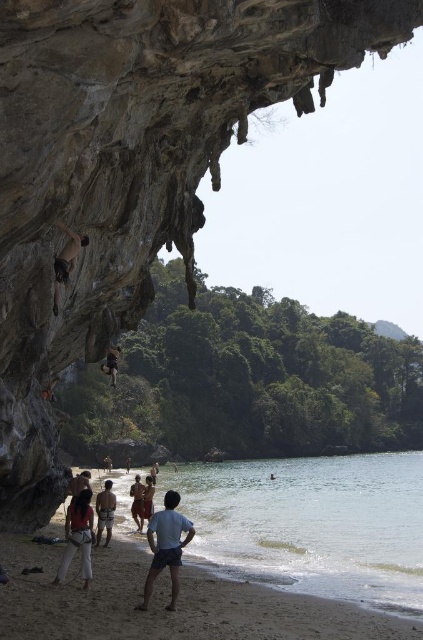
Question: Can you confirm if clear water at lower center is smaller than light blue shorts at lower center?

Choices:
 (A) yes
 (B) no

Answer: (B)

Question: Among these objects, which one is farthest from the camera?

Choices:
 (A) light blue shorts at lower center
 (B) matte red shorts at lower left
 (C) nude skin rock climber at left
 (D) brown textured shorts at lower center

Answer: (D)

Question: Which of the following is the farthest from the observer?

Choices:
 (A) clear water at lower center
 (B) nude skin rock climber at left
 (C) smooth sand beach at lower center
 (D) light blue shorts at lower center

Answer: (A)

Question: Which of the following is the farthest from the observer?

Choices:
 (A) nude skin rock climber at left
 (B) clear water at lower center

Answer: (B)

Question: Is smooth sand beach at lower center thinner than nude skin rock climber at left?

Choices:
 (A) yes
 (B) no

Answer: (B)

Question: Does smooth sand beach at lower center have a smaller size compared to brown textured shorts at lower center?

Choices:
 (A) yes
 (B) no

Answer: (B)